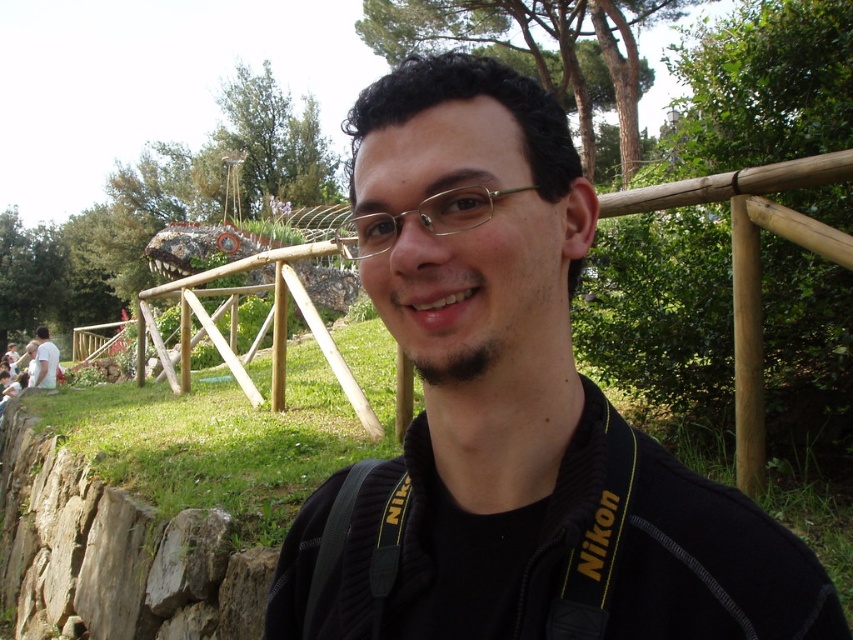
Is black matte jacket at center further to the viewer compared to white cotton shirt at lower left?

No, it is in front of white cotton shirt at lower left.

The height and width of the screenshot is (640, 853). Describe the element at coordinates (515, 419) in the screenshot. I see `black matte jacket at center` at that location.

Between point (479, 404) and point (53, 349), which one is positioned in front?

Point (479, 404) is more forward.

Where is `black matte jacket at center`? The image size is (853, 640). black matte jacket at center is located at coordinates (515, 419).

Consider the image. Between gold metallic glasses at center and white cotton shirt at lower left, which one has less height?

Standing shorter between the two is gold metallic glasses at center.

The image size is (853, 640). Find the location of `gold metallic glasses at center`. gold metallic glasses at center is located at coordinates (421, 220).

Between point (421, 532) and point (357, 234), which one is positioned in front?

Point (421, 532) is more forward.

Does point (523, 307) lie behind point (457, 208)?

Yes, point (523, 307) is farther from viewer.

Is point (509, 547) farther from viewer compared to point (357, 228)?

No, it is in front of (357, 228).

Locate an element on the screen. The height and width of the screenshot is (640, 853). black matte jacket at center is located at coordinates (515, 419).